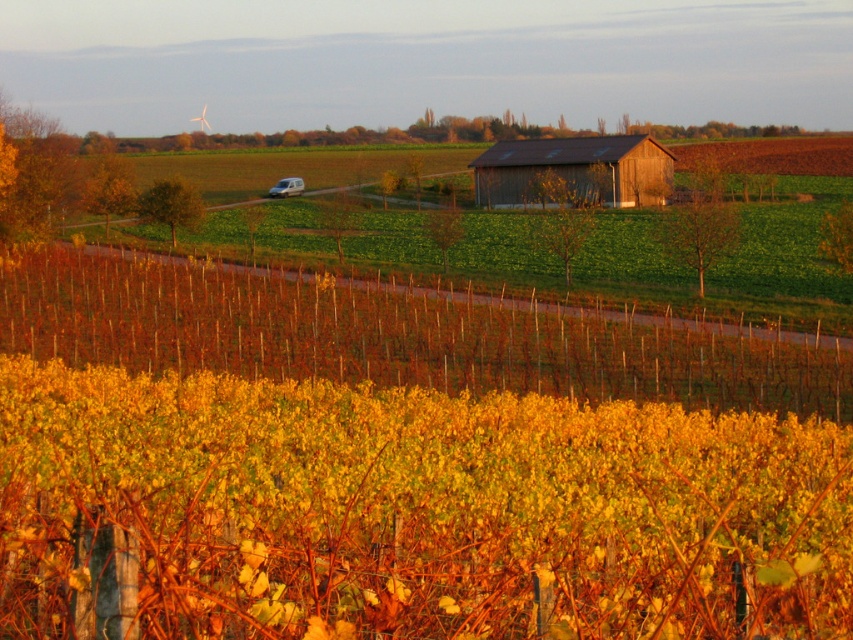
Question: Among these objects, which one is farthest from the camera?

Choices:
 (A) yellow-green leaves at lower center
 (B) wooden barn at center

Answer: (B)

Question: In this image, where is yellow-green leaves at lower center located relative to wooden barn at center?

Choices:
 (A) right
 (B) left

Answer: (B)

Question: From the image, what is the correct spatial relationship of yellow-green leaves at lower center in relation to wooden barn at center?

Choices:
 (A) above
 (B) below

Answer: (B)

Question: Is yellow-green leaves at lower center closer to the viewer compared to wooden barn at center?

Choices:
 (A) no
 (B) yes

Answer: (B)